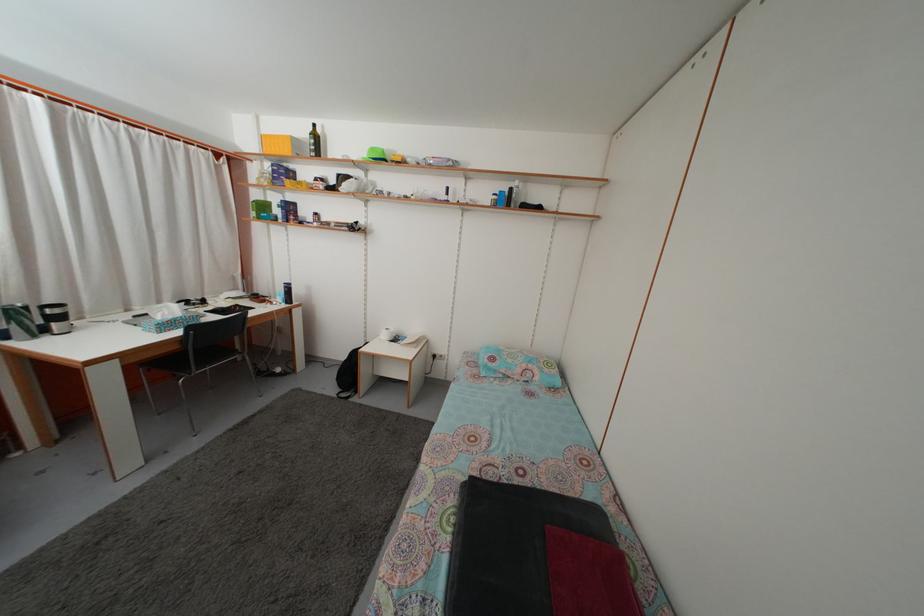
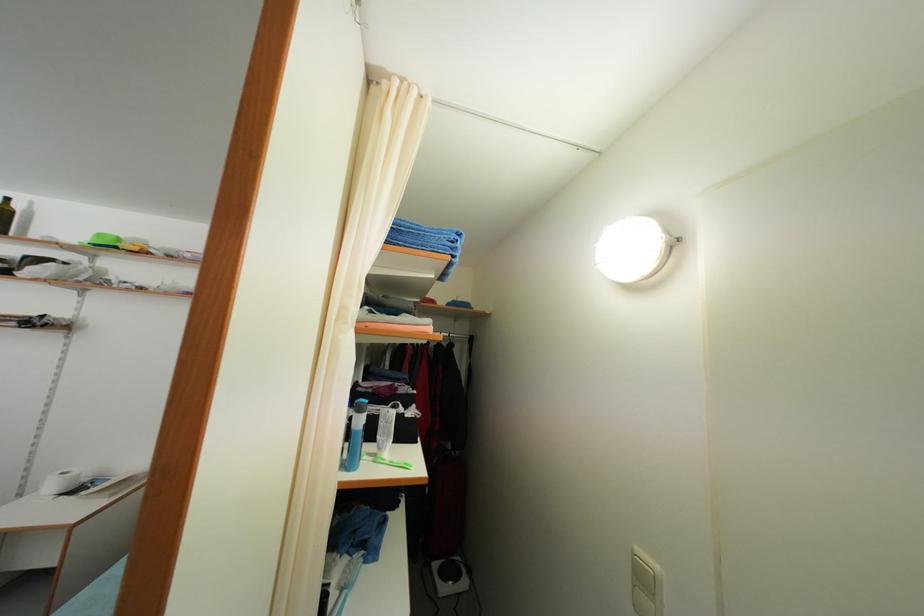
The point at (x=391, y=342) is marked in the first image. Where is the corresponding point in the second image?

(56, 493)